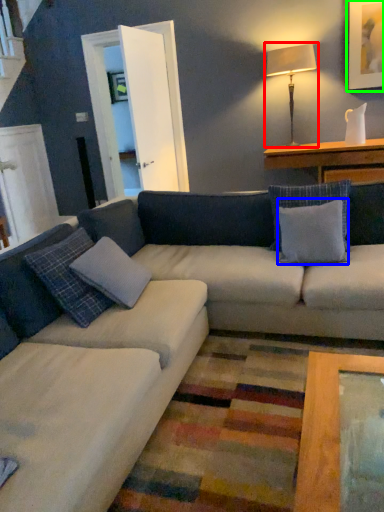
Question: Which is farther away from table lamp (highlighted by a red box)? pillow (highlighted by a blue box) or picture frame (highlighted by a green box)?

Choices:
 (A) pillow
 (B) picture frame

Answer: (A)